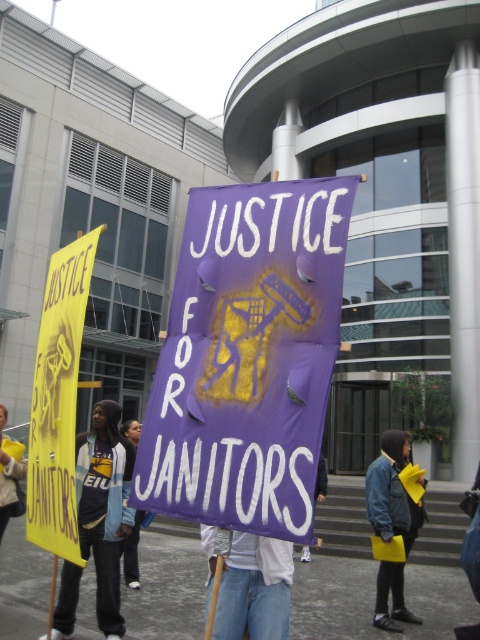
Is purple paper sign at center smaller than denim jacket at lower right?

Correct, purple paper sign at center occupies less space than denim jacket at lower right.

Which is behind, point (201, 268) or point (399, 525)?

The point (399, 525) is more distant.

Which is in front, point (168, 497) or point (381, 506)?

Point (168, 497) is more forward.

The height and width of the screenshot is (640, 480). Identify the location of purple paper sign at center. (248, 356).

Is yellow fabric shirt at center positioned in front of denim jacket at lower right?

Yes, it is in front of denim jacket at lower right.

Is yellow fabric shirt at center below denim jacket at lower right?

No, yellow fabric shirt at center is not below denim jacket at lower right.

Locate an element on the screen. yellow fabric shirt at center is located at coordinates (105, 508).

Which of these two, denim jacket at lower right or yellow paper sign at center, stands shorter?

Standing shorter between the two is yellow paper sign at center.

Who is more distant from viewer, [380,580] or [8,461]?

The point [380,580] is behind.

Which is behind, point (368, 508) or point (10, 461)?

Point (368, 508)

The width and height of the screenshot is (480, 640). I want to click on denim jacket at lower right, so click(392, 492).